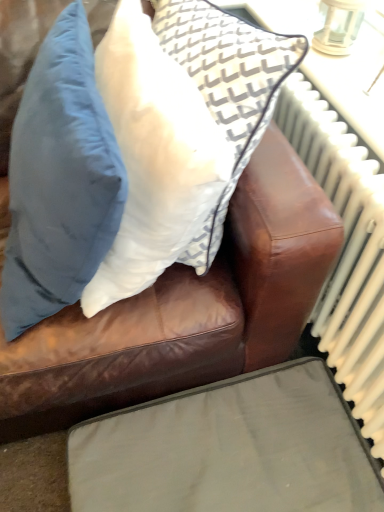
Question: Considering the positions of matte blue pillow at upper left, placed as the 2th pillow when sorted from right to left, and white fabric pillow at upper center, which is counted as the 2th pillow, starting from the left, in the image, is matte blue pillow at upper left, placed as the 2th pillow when sorted from right to left, taller or shorter than white fabric pillow at upper center, which is counted as the 2th pillow, starting from the left,?

Choices:
 (A) short
 (B) tall

Answer: (B)

Question: Is point (11, 224) closer or farther from the camera than point (127, 13)?

Choices:
 (A) farther
 (B) closer

Answer: (A)

Question: Based on their relative distances, which object is nearer to the matte gray cushion at lower center?

Choices:
 (A) matte blue pillow at upper left, the first pillow from the left
 (B) white metallic radiator at right
 (C) white fabric pillow at upper center, the first pillow viewed from the right

Answer: (B)

Question: Which object is positioned farthest from the matte blue pillow at upper left, the first pillow from the left?

Choices:
 (A) white metallic radiator at right
 (B) matte gray cushion at lower center
 (C) white fabric pillow at upper center, the first pillow viewed from the right

Answer: (B)